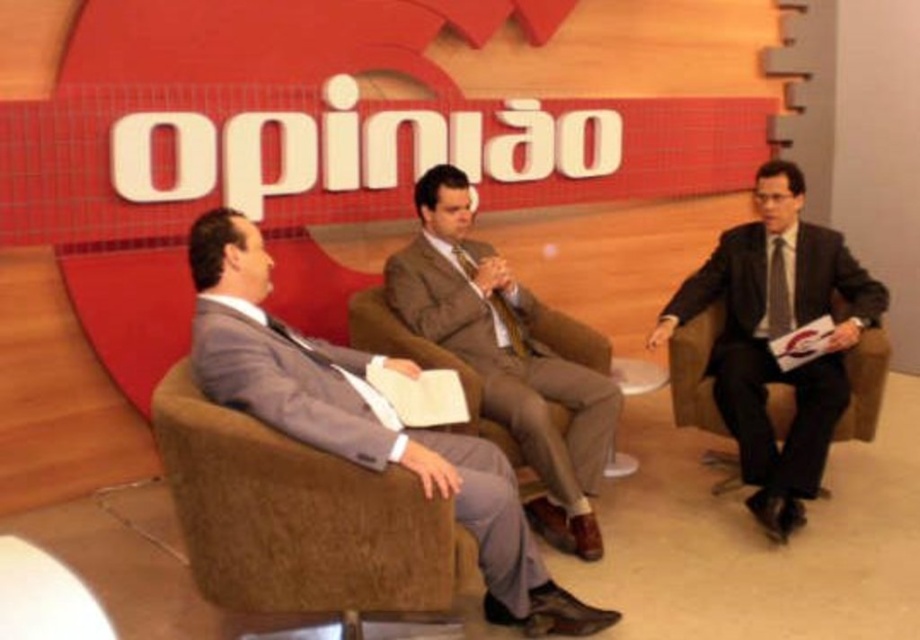
Can you confirm if matte gray suit at center is thinner than brown fabric suit at center?

No, matte gray suit at center is not thinner than brown fabric suit at center.

Does matte gray suit at center have a smaller size compared to brown fabric suit at center?

Actually, matte gray suit at center might be larger than brown fabric suit at center.

Between point (598, 608) and point (487, 337), which one is positioned behind?

The point (487, 337) is behind.

In order to click on matte gray suit at center in this screenshot , I will do `click(362, 420)`.

Does brown fabric swivel chair at center have a lesser width compared to brown fabric suit at center?

Correct, brown fabric swivel chair at center's width is less than brown fabric suit at center's.

Does brown fabric swivel chair at center come behind brown fabric suit at center?

No, brown fabric swivel chair at center is in front of brown fabric suit at center.

Which is in front, point (190, 540) or point (486, 284)?

Point (190, 540)

You are a GUI agent. You are given a task and a screenshot of the screen. Output one action in this format:
    pyautogui.click(x=<x>, y=<y>)
    Task: Click on the brown fabric swivel chair at center
    The height and width of the screenshot is (640, 920).
    Given the screenshot: What is the action you would take?
    pyautogui.click(x=299, y=516)

Is brown fabric swivel chair at center shorter than matte gray suit at center?

Correct, brown fabric swivel chair at center is not as tall as matte gray suit at center.

Which is more to the right, brown fabric swivel chair at center or matte gray suit at center?

From the viewer's perspective, matte gray suit at center appears more on the right side.

Where is `brown fabric swivel chair at center`? The height and width of the screenshot is (640, 920). brown fabric swivel chair at center is located at coordinates (299, 516).